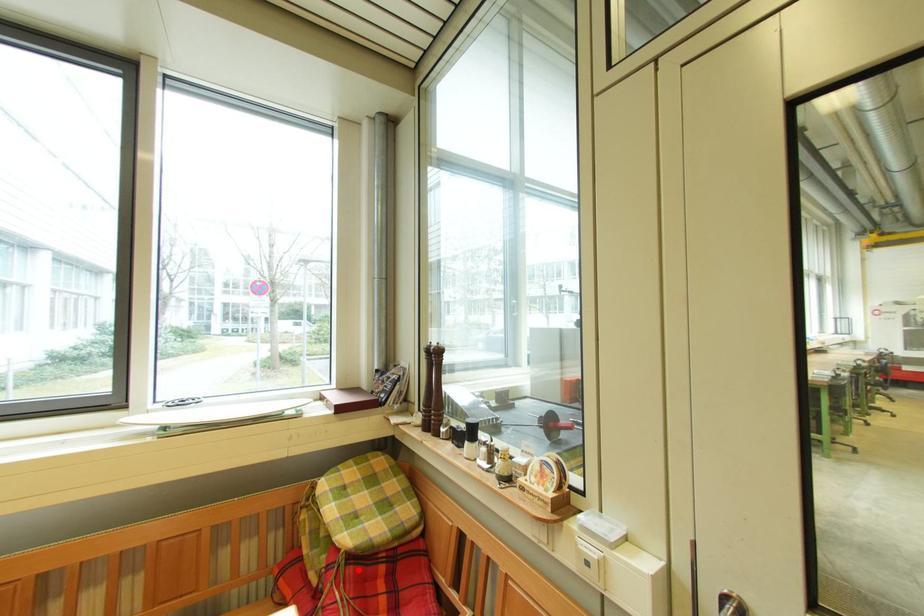
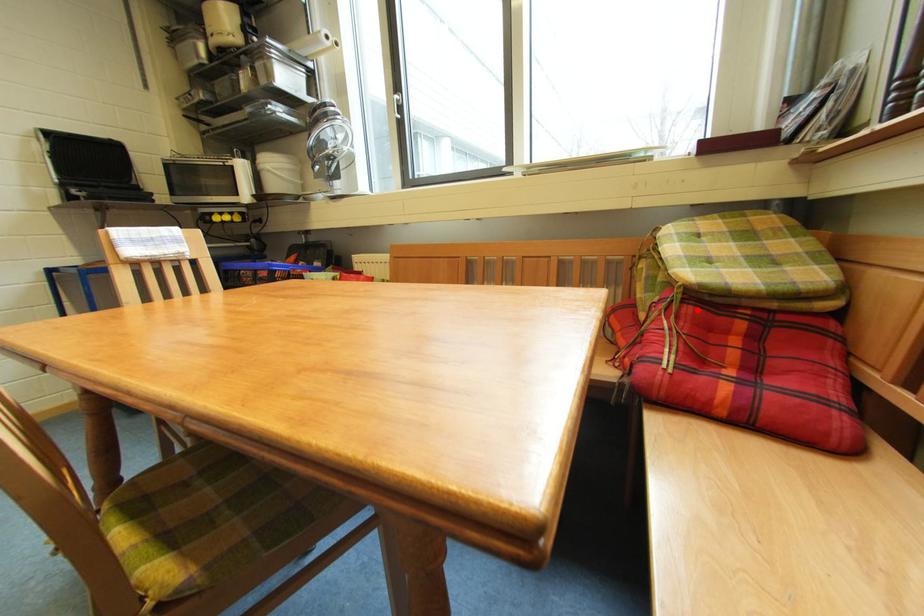
I am providing you with two images of the same scene from different viewpoints. A red point is marked on the first image and another point is marked on the second image. Does the point marked in image1 correspond to the same location as the one in image2?

Yes